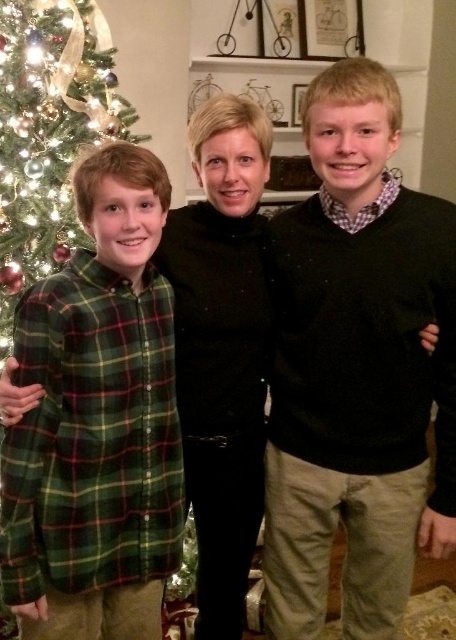
Question: Which of the following is the farthest from the observer?

Choices:
 (A) pos(41,72)
 (B) pos(289,298)

Answer: (A)

Question: Among these points, which one is nearest to the camera?

Choices:
 (A) (77, 122)
 (B) (279, 442)

Answer: (B)

Question: Considering the relative positions of green plaid shirt at left and green matte christmas tree at left in the image provided, where is green plaid shirt at left located with respect to green matte christmas tree at left?

Choices:
 (A) below
 (B) above

Answer: (A)

Question: Which point appears farthest from the camera in this image?

Choices:
 (A) (29, 38)
 (B) (295, 250)
 (C) (34, 592)

Answer: (A)

Question: Can you confirm if matte black sweater at center is positioned to the left of green matte christmas tree at left?

Choices:
 (A) yes
 (B) no

Answer: (B)

Question: Is green plaid shirt at left closer to the viewer compared to green matte christmas tree at left?

Choices:
 (A) yes
 (B) no

Answer: (A)